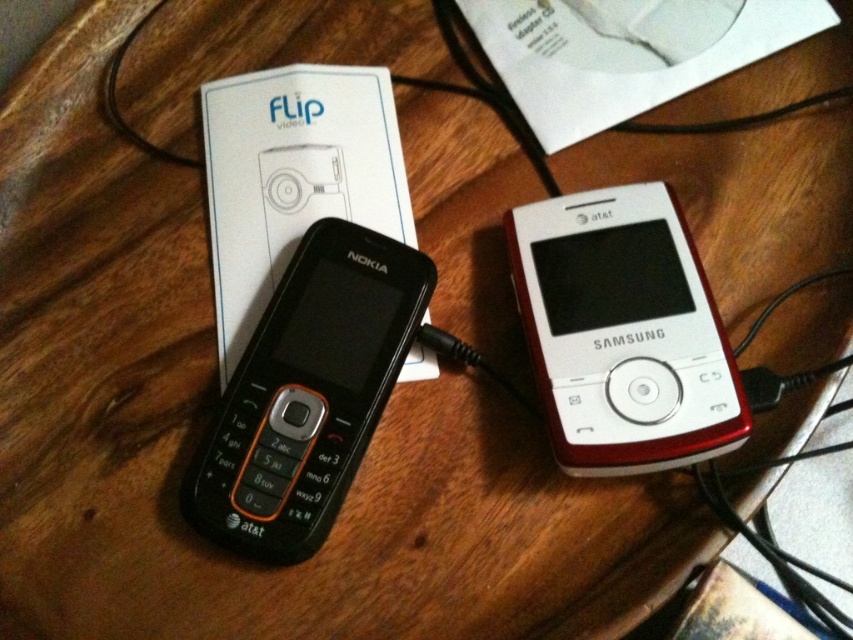
Question: Considering the relative positions of white glossy ipod at center and black plastic nokia phone at center in the image provided, where is white glossy ipod at center located with respect to black plastic nokia phone at center?

Choices:
 (A) below
 (B) above

Answer: (B)

Question: Is white glossy ipod at center thinner than black plastic earphone at center?

Choices:
 (A) no
 (B) yes

Answer: (A)

Question: Which of the following is the farthest from the observer?

Choices:
 (A) (305, 358)
 (B) (286, 200)

Answer: (B)

Question: Which point appears farthest from the camera in this image?

Choices:
 (A) (276, 164)
 (B) (531, 280)

Answer: (A)

Question: Among these objects, which one is nearest to the camera?

Choices:
 (A) black plastic nokia phone at center
 (B) black plastic earphone at center
 (C) white glossy ipod at center

Answer: (C)

Question: Can you confirm if white glossy ipod at center is positioned below black plastic nokia phone at center?

Choices:
 (A) no
 (B) yes

Answer: (A)